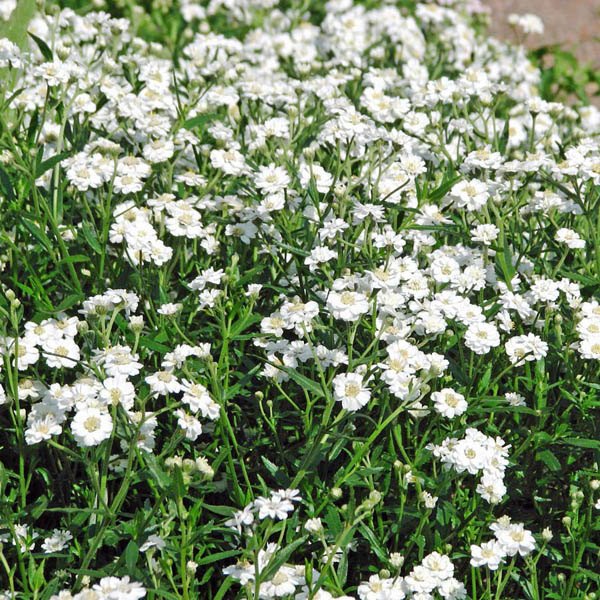
Find the location of a particular element. The image size is (600, 600). bouquet of white lowers upper righ is located at coordinates (527, 24).